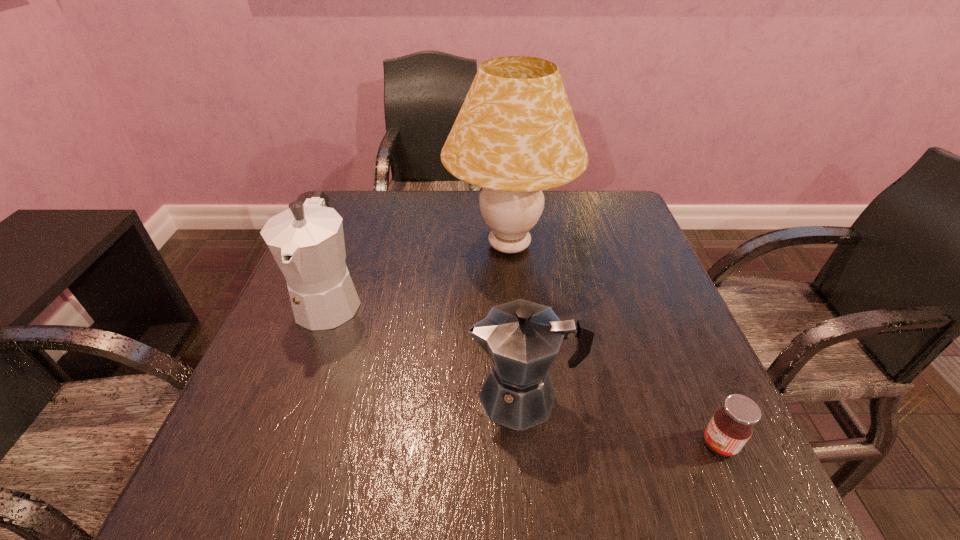
Where is `vacant space at the far edge of the desktop`? vacant space at the far edge of the desktop is located at coordinates (439, 224).

Identify the location of free space at the near edge of the desktop. (517, 492).

Identify the location of vacant region at the left edge of the desktop. The image size is (960, 540). (303, 430).

Identify the location of vacant space at the right edge. (628, 370).

In the image, there is a desktop. At what (x,y) coordinates should I click in order to perform the action: click on vacant area at the near left corner. Please return your answer as a coordinate pair (x, y). Looking at the image, I should click on (284, 464).

You are a GUI agent. You are given a task and a screenshot of the screen. Output one action in this format:
    pyautogui.click(x=<x>, y=<y>)
    Task: Click on the free space between the right coffeepot and the farther coffeepot
    
    Given the screenshot: What is the action you would take?
    pyautogui.click(x=426, y=348)

This screenshot has width=960, height=540. I want to click on free space between the rightmost object and the tallest object, so click(614, 345).

The width and height of the screenshot is (960, 540). What are the coordinates of `empty space that is in between the taller coffeepot and the lampshade` in the screenshot? It's located at (420, 272).

Locate an element on the screen. This screenshot has width=960, height=540. vacant space that's between the shorter coffeepot and the jam is located at coordinates (621, 420).

Find the location of a particular element. This screenshot has height=540, width=960. vacant point located between the rightmost object and the shorter coffeepot is located at coordinates (621, 420).